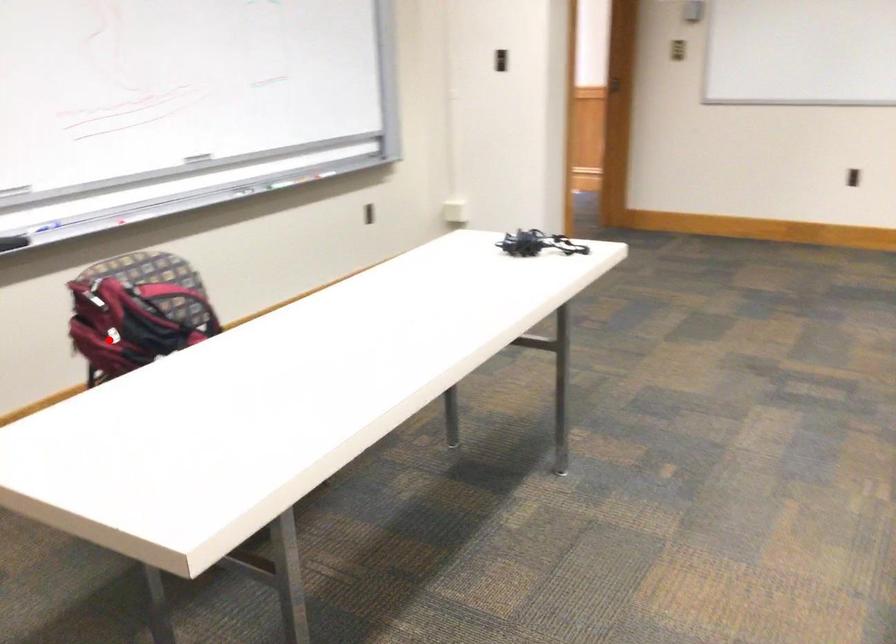
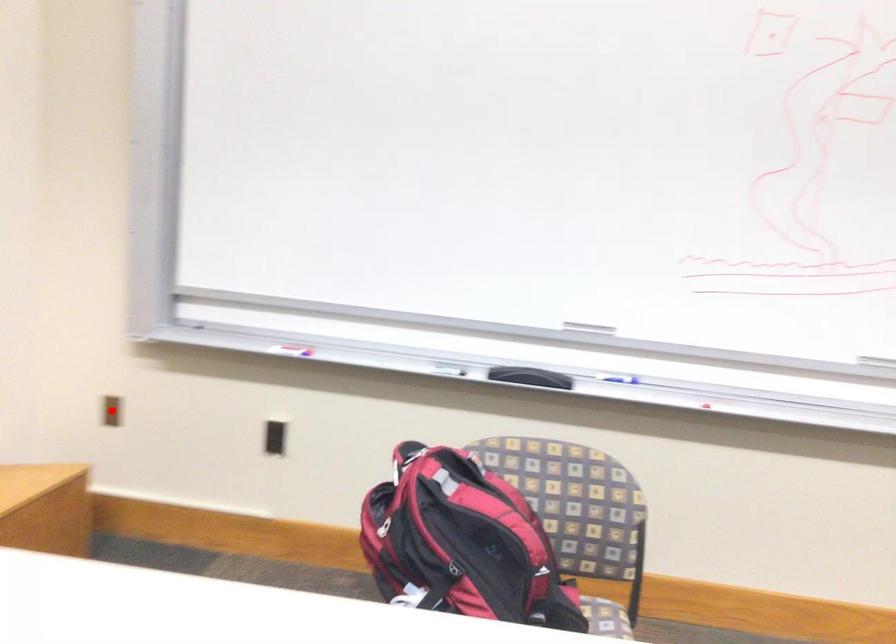
I am providing you with two images of the same scene from different viewpoints. A red point is marked on the first image and another point is marked on the second image. Is the marked point in image1 the same physical position as the marked point in image2?

No